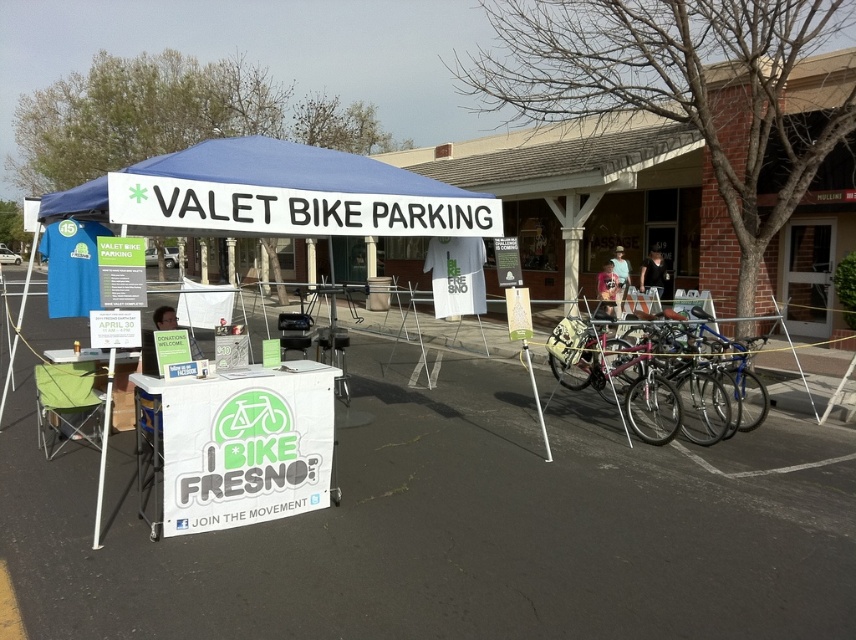
You are a participant at the event and want to place your shiny silver bicycle at center right near the matte blue shirt at center. Given that the minimum safe distance required between bikes is 15 feet, is the current placement compliant with safety guidelines?

The distance between the shiny silver bicycle at center right and the matte blue shirt at center is 16.58 feet, which exceeds the minimum required 15 feet. Therefore, the current placement is compliant with safety guidelines.

You are a visitor at the event and want to find the valet bike parking area. You see the blue fabric canopy at center and the white plastic pole at lower left. Which object is taller?

The white plastic pole at lower left is taller than the blue fabric canopy at center.